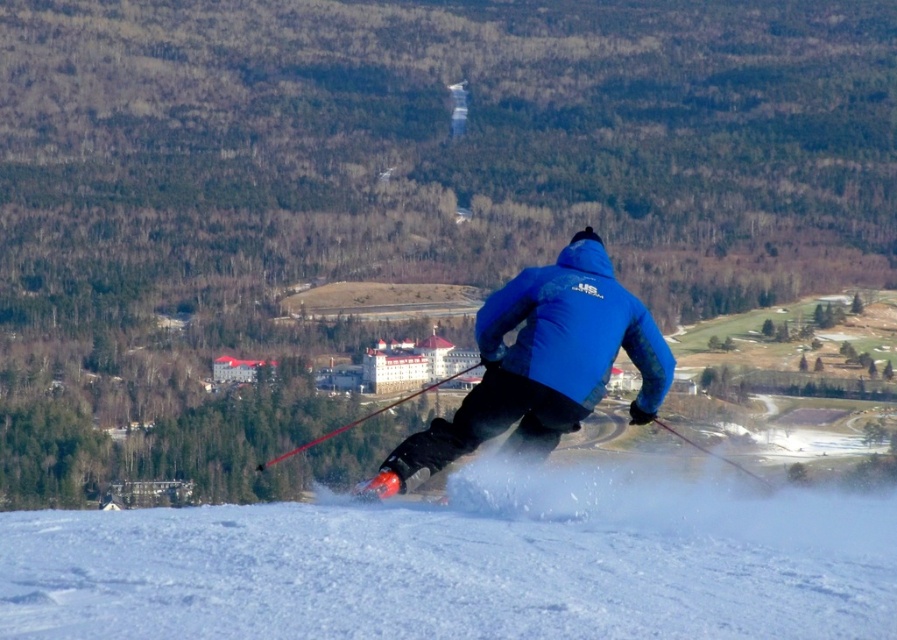
You are a photographer trying to capture the skier in the scene. You notice two jackets on the skier, the blue matte jacket at center and the blue softshell jacket at center. Which jacket is closer to the camera?

The blue matte jacket at center is closer to the camera because it is in front of the blue softshell jacket at center.

You are a photographer trying to capture the skier in the image. You want to ensure the blue matte jacket at center is visible in front of the white powdery snow at center. Is this possible given their positions?

The white powdery snow at center is in front of the blue matte jacket at center, so the jacket will be partially or fully obscured by the snow, making it less visible.